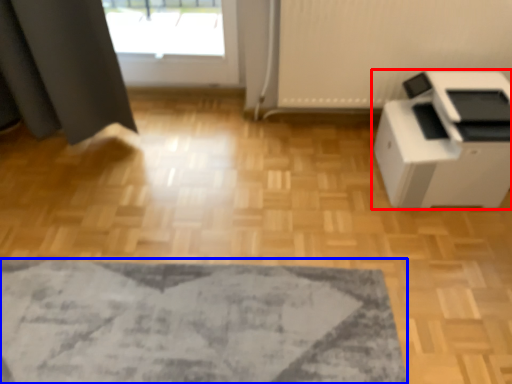
Question: Which object is further to the camera taking this photo, home appliance (highlighted by a red box) or mat (highlighted by a blue box)?

Choices:
 (A) home appliance
 (B) mat

Answer: (A)